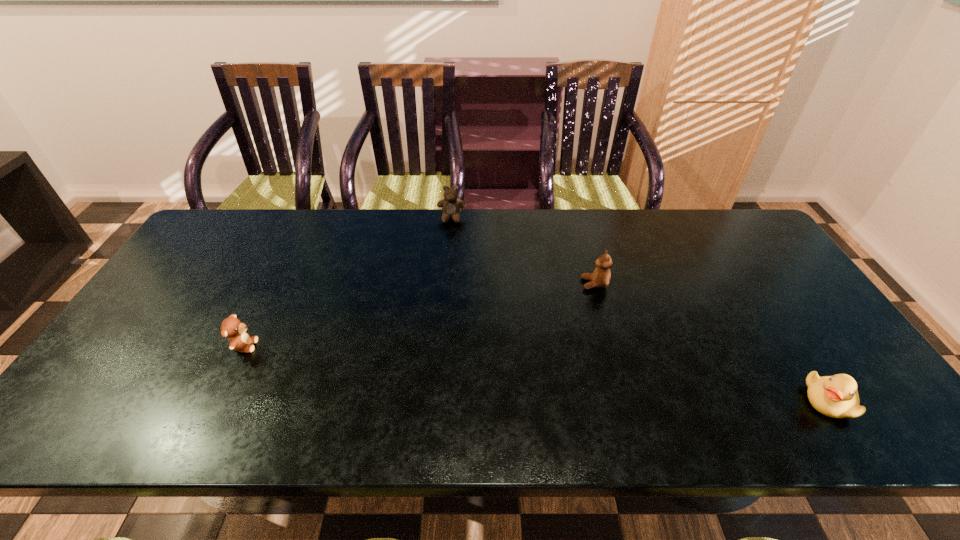
I want to click on the second teddy bear from left to right, so click(451, 206).

Identify the location of the third object from right to left. Image resolution: width=960 pixels, height=540 pixels. (451, 206).

Where is `the rightmost teddy bear`? This screenshot has height=540, width=960. the rightmost teddy bear is located at coordinates (601, 277).

The image size is (960, 540). What are the coordinates of `the second farthest object` in the screenshot? It's located at (601, 277).

Locate an element on the screen. the second nearest object is located at coordinates (233, 328).

The image size is (960, 540). In order to click on the leftmost object in this screenshot , I will do click(233, 328).

Locate an element on the screen. This screenshot has height=540, width=960. duckling is located at coordinates (836, 396).

I want to click on the rightmost object, so click(836, 396).

Identify the location of vacant point located 0.310m on the face of the farthest teddy bear. (446, 289).

The width and height of the screenshot is (960, 540). I want to click on free space located 0.150m at the face of the third object from left to right, so click(x=530, y=284).